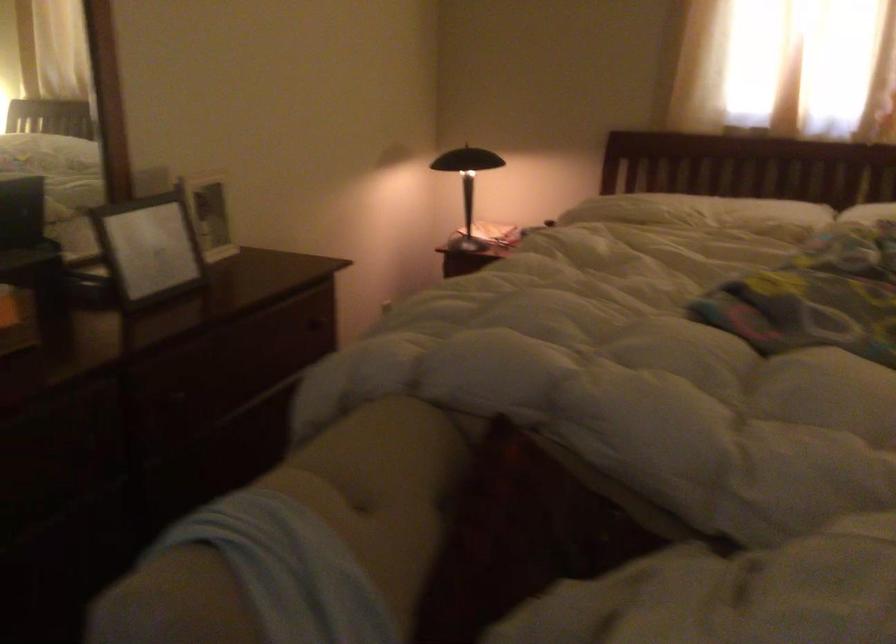
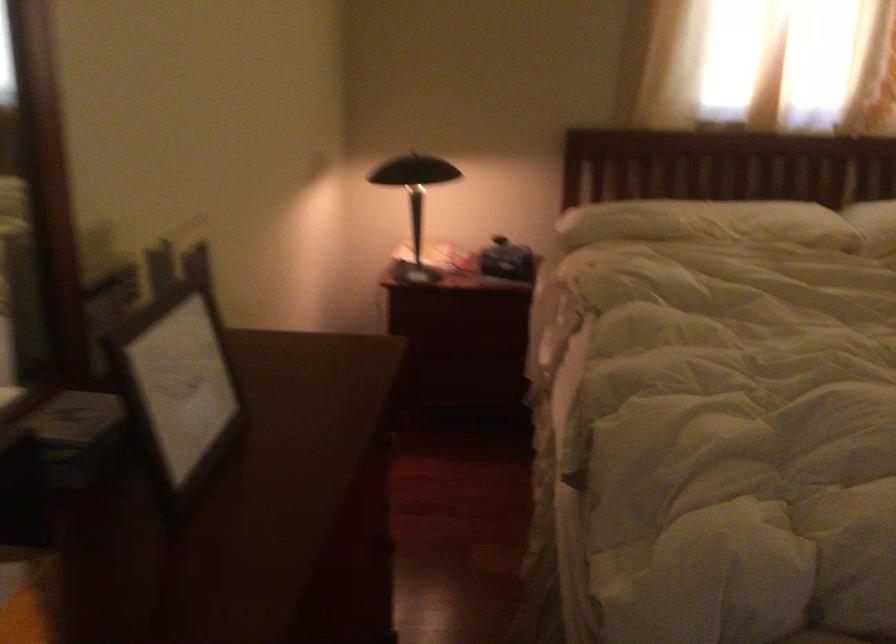
In a continuous first-person perspective shot, in which direction is the camera moving?

The cameraman moved toward left, forward.